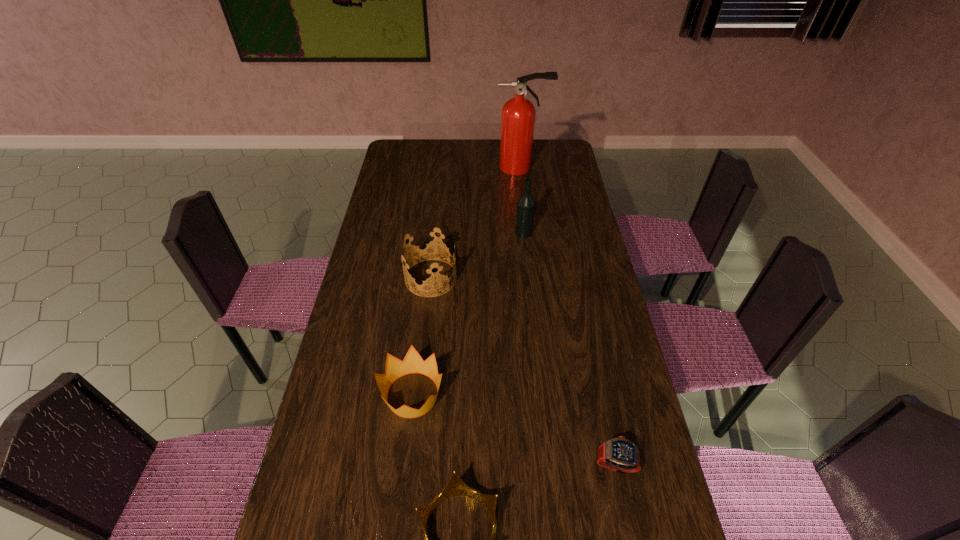
The width and height of the screenshot is (960, 540). Find the location of `fire extinguisher`. fire extinguisher is located at coordinates (518, 114).

The image size is (960, 540). Find the location of `the farthest object`. the farthest object is located at coordinates (518, 114).

Locate an element on the screen. the second tallest object is located at coordinates [x=526, y=204].

Locate an element on the screen. This screenshot has height=540, width=960. vodka is located at coordinates (526, 204).

Where is `the fourth shortest object`? This screenshot has height=540, width=960. the fourth shortest object is located at coordinates (428, 243).

This screenshot has height=540, width=960. I want to click on the third farthest object, so click(428, 243).

Find the location of a particular element. The height and width of the screenshot is (540, 960). the second nearest crown is located at coordinates (412, 363).

Image resolution: width=960 pixels, height=540 pixels. What are the coordinates of `watch` in the screenshot? It's located at (619, 454).

In order to click on the shortest object in this screenshot , I will do `click(619, 454)`.

Identify the location of free space located 0.050m on the front of the farthest object. 523,183.